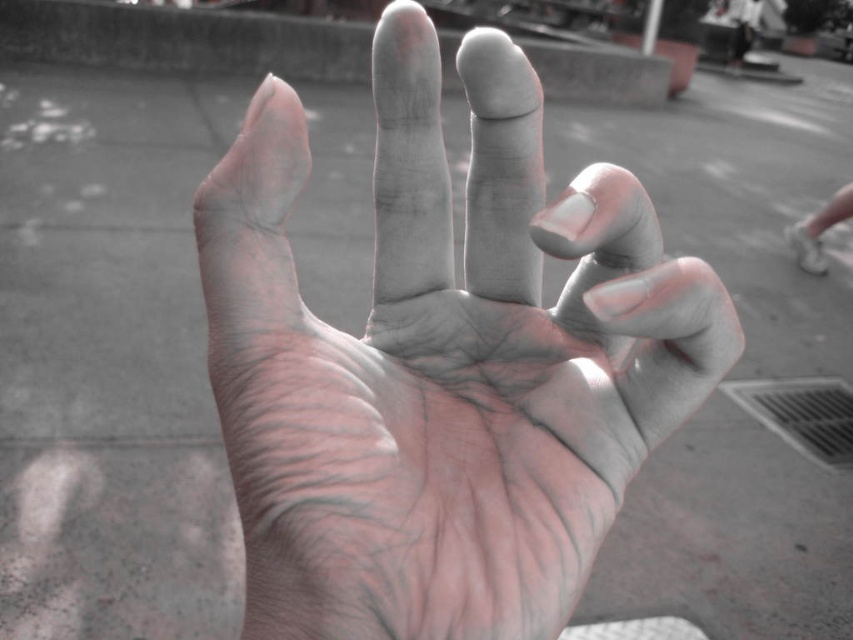
You are a photographer trying to capture the smooth skin hand at center and the white matte shoe at lower right in a single frame. Based on their positions, which object should you focus on first to ensure both are in focus?

The smooth skin hand at center is located below the white matte shoe at lower right. To ensure both are in focus, you should focus on the white matte shoe at lower right first since it is farther away, as depth of field typically extends further behind the point of focus than in front.

You are a delivery robot that needs to place a package in the image. The package is 1 foot long. You see the smooth skin hand at center and the white matte shoe at lower right. Can you fit the package between them without bending it?

The smooth skin hand at center and the white matte shoe at lower right are 11.74 feet apart, so yes, the package can fit between them since the distance is greater than the package length.

You are a photographer trying to capture a closeup of the smooth skin hand at center and the white matte shoe at lower right in the same frame. Based on their sizes in the image, which object would you need to move closer to the camera to make them appear the same size?

The smooth skin hand at center is shorter than the white matte shoe at lower right. To make them appear the same size, you should move the smooth skin hand at center closer to the camera.